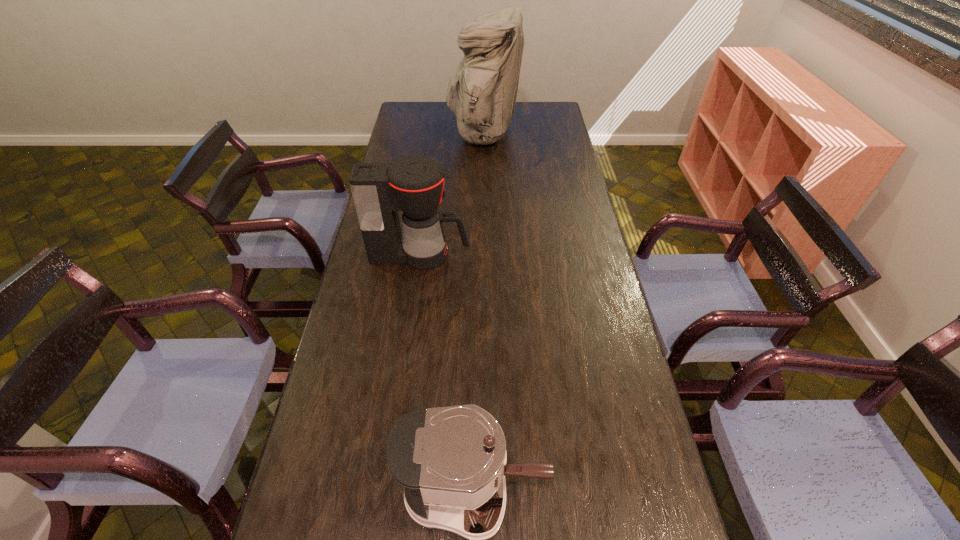
Where is `free space at the left edge`? Image resolution: width=960 pixels, height=540 pixels. free space at the left edge is located at coordinates (x=333, y=373).

In the image, there is a desktop. At what (x,y) coordinates should I click in order to perform the action: click on vacant space at the right edge. Please return your answer as a coordinate pair (x, y). Looking at the image, I should click on (559, 162).

Locate an element on the screen. The width and height of the screenshot is (960, 540). free region at the far right corner of the desktop is located at coordinates (540, 113).

The height and width of the screenshot is (540, 960). I want to click on empty space between the taller coffee maker and the backpack, so click(x=452, y=194).

At what (x,y) coordinates should I click in order to perform the action: click on unoccupied position between the second shortest object and the backpack. Please return your answer as a coordinate pair (x, y). The height and width of the screenshot is (540, 960). Looking at the image, I should click on pyautogui.click(x=452, y=194).

The width and height of the screenshot is (960, 540). I want to click on vacant point located between the tallest object and the second tallest object, so click(x=452, y=194).

You are a GUI agent. You are given a task and a screenshot of the screen. Output one action in this format:
    pyautogui.click(x=<x>, y=<y>)
    Task: Click on the unoccupied position between the farthest object and the second tallest object
    
    Given the screenshot: What is the action you would take?
    pyautogui.click(x=452, y=194)

I want to click on free spot between the second nearest object and the farthest object, so click(452, 194).

Where is `vacant space in between the tallest object and the second nearest object`? This screenshot has height=540, width=960. vacant space in between the tallest object and the second nearest object is located at coordinates (452, 194).

Point out which object is positioned as the nearest to the backpack. Please provide its 2D coordinates. Your answer should be formatted as a tuple, i.e. [(x, y)], where the tuple contains the x and y coordinates of a point satisfying the conditions above.

[(414, 185)]